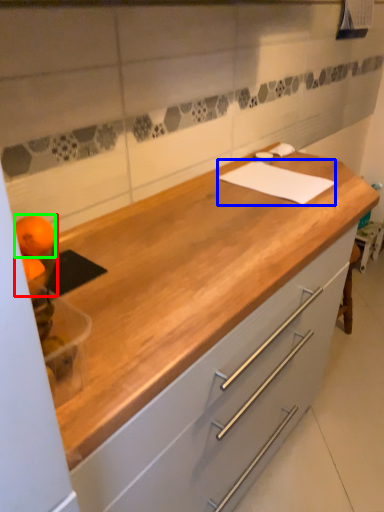
Question: Which is farther away from orange (highlighted by a red box)? notepad (highlighted by a blue box) or orange (highlighted by a green box)?

Choices:
 (A) notepad
 (B) orange

Answer: (A)